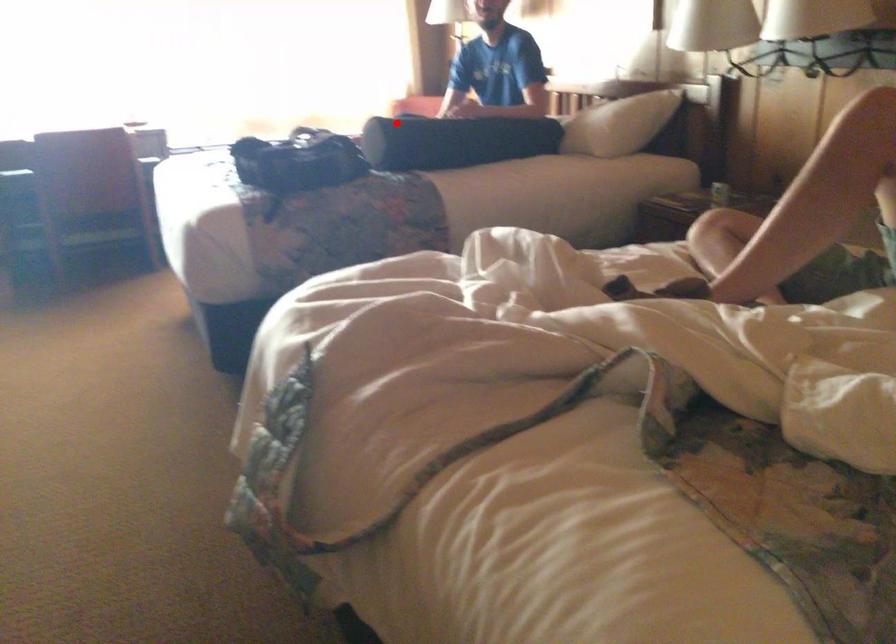
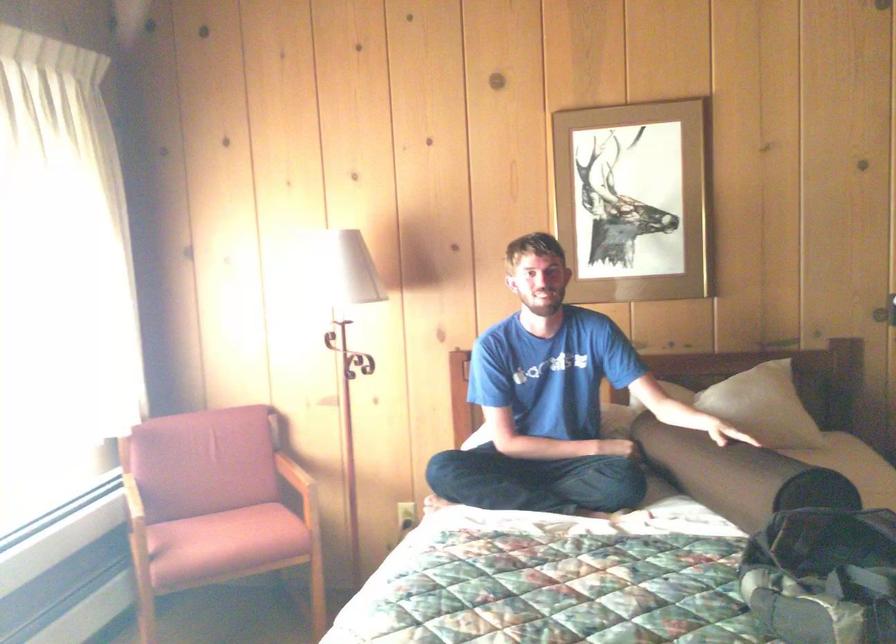
Question: A red point is marked in image1. In image2, is the corresponding 3D point closer to the camera or farther? Reply with the corresponding letter.

Choices:
 (A) The corresponding 3D point is closer.
 (B) The corresponding 3D point is farther.

Answer: (A)